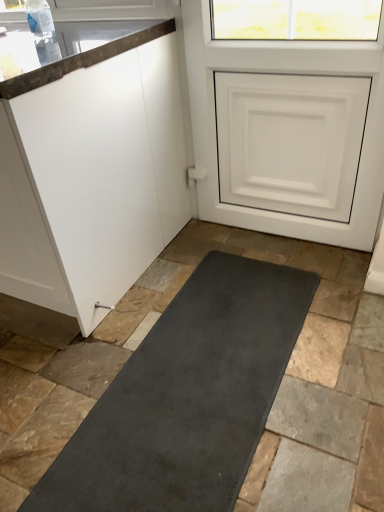
Question: From the image's perspective, would you say white matte door at upper right is positioned over white matte cabinet at left?

Choices:
 (A) yes
 (B) no

Answer: (A)

Question: Is white matte door at upper right not close to white matte cabinet at left?

Choices:
 (A) no
 (B) yes

Answer: (A)

Question: Does white matte door at upper right have a greater height compared to white matte cabinet at left?

Choices:
 (A) yes
 (B) no

Answer: (A)

Question: Is white matte door at upper right facing away from white matte cabinet at left?

Choices:
 (A) no
 (B) yes

Answer: (A)

Question: Is white matte door at upper right wider than white matte cabinet at left?

Choices:
 (A) yes
 (B) no

Answer: (B)

Question: From a real-world perspective, is white matte door at upper right physically above white matte cabinet at left?

Choices:
 (A) yes
 (B) no

Answer: (A)

Question: Does white matte cabinet at left have a lesser width compared to white matte door at upper right?

Choices:
 (A) no
 (B) yes

Answer: (A)

Question: Does white matte cabinet at left touch white matte door at upper right?

Choices:
 (A) no
 (B) yes

Answer: (A)

Question: Does white matte cabinet at left appear on the right side of white matte door at upper right?

Choices:
 (A) yes
 (B) no

Answer: (B)

Question: Does white matte cabinet at left have a greater height compared to white matte door at upper right?

Choices:
 (A) no
 (B) yes

Answer: (A)

Question: Is white matte cabinet at left not inside white matte door at upper right?

Choices:
 (A) no
 (B) yes

Answer: (B)

Question: Is white matte door at upper right at the back of white matte cabinet at left?

Choices:
 (A) yes
 (B) no

Answer: (B)

Question: Looking at their shapes, would you say white matte door at upper right is wider or thinner than white matte cabinet at left?

Choices:
 (A) thin
 (B) wide

Answer: (A)